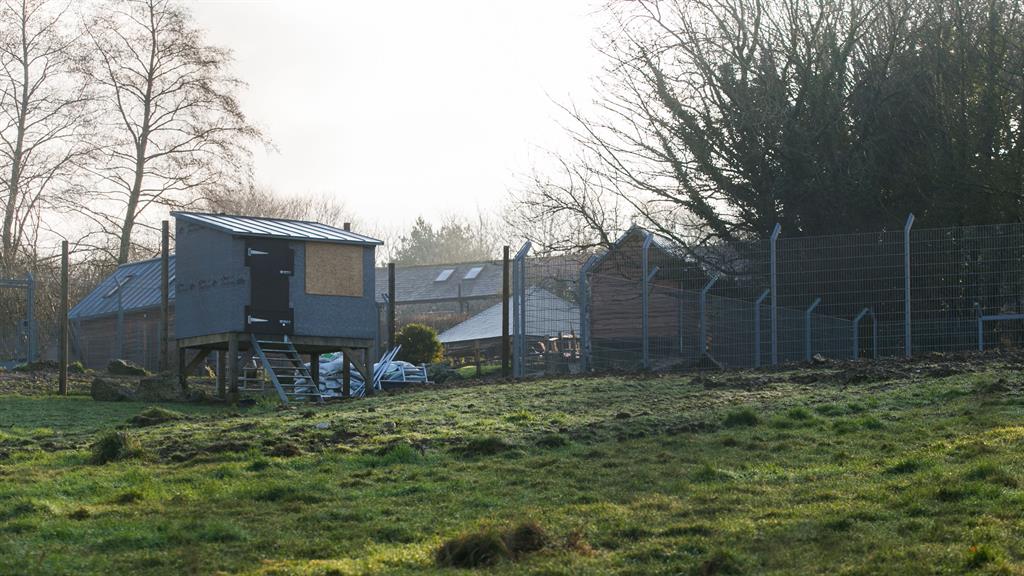
This screenshot has width=1024, height=576. I want to click on stairs, so click(x=290, y=376).